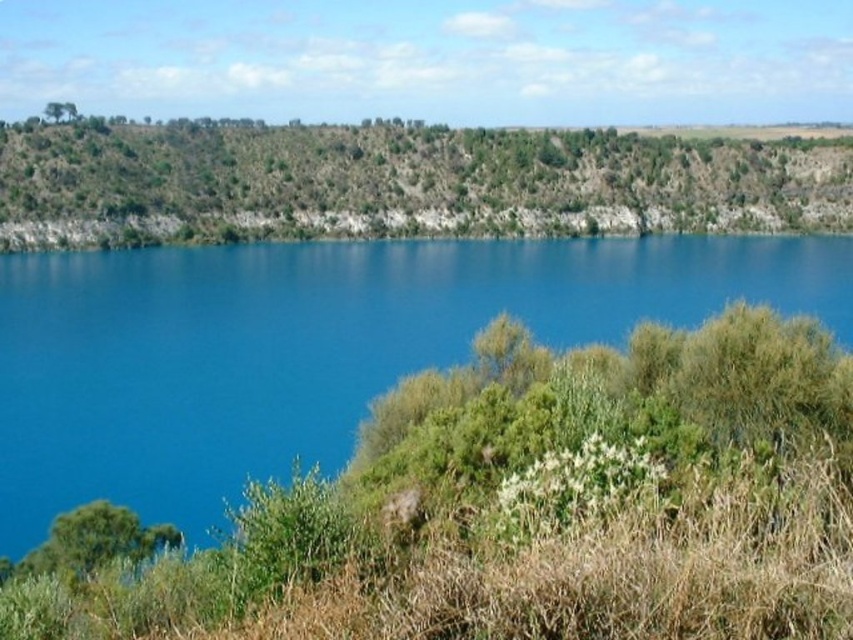
Can you confirm if blue water at center is smaller than green grassy hillside at upper center?

Yes, blue water at center is smaller than green grassy hillside at upper center.

From the picture: Who is more distant from viewer, (65, 388) or (160, 124)?

The point (160, 124) is behind.

The image size is (853, 640). What do you see at coordinates (312, 348) in the screenshot?
I see `blue water at center` at bounding box center [312, 348].

You are a GUI agent. You are given a task and a screenshot of the screen. Output one action in this format:
    pyautogui.click(x=<x>, y=<y>)
    Task: Click on the blue water at center
    
    Given the screenshot: What is the action you would take?
    pyautogui.click(x=312, y=348)